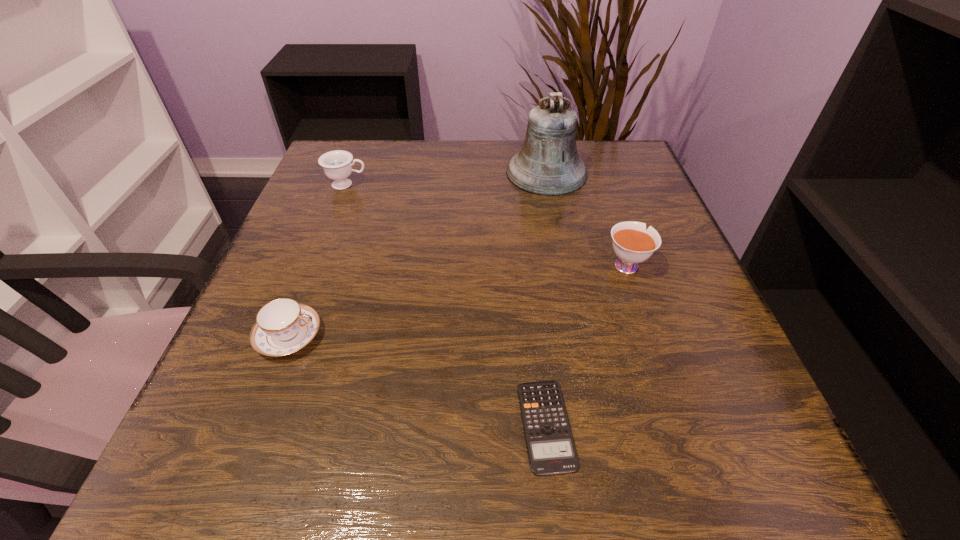
In order to click on the tallest object in this screenshot , I will do `click(548, 164)`.

You are a GUI agent. You are given a task and a screenshot of the screen. Output one action in this format:
    pyautogui.click(x=<x>, y=<y>)
    Task: Click on the second farthest teacup
    The width and height of the screenshot is (960, 540).
    Given the screenshot: What is the action you would take?
    pyautogui.click(x=632, y=243)

Locate an element on the screen. Image resolution: width=960 pixels, height=540 pixels. the rightmost teacup is located at coordinates (632, 243).

Identify the location of the farthest teacup. The height and width of the screenshot is (540, 960). point(337,165).

This screenshot has height=540, width=960. In order to click on the fourth farthest object in this screenshot , I will do `click(283, 326)`.

What are the coordinates of `the nearest teacup` in the screenshot? It's located at (283, 326).

Locate an element on the screen. This screenshot has width=960, height=540. the shortest object is located at coordinates (551, 449).

What are the coordinates of `calculator` in the screenshot? It's located at (551, 449).

I want to click on free spot located on the left of the bell, so click(x=427, y=173).

At what (x,y) coordinates should I click in order to perform the action: click on vacant space positioned 0.150m on the side of the third farthest object with the handle. Please return your answer as a coordinate pair (x, y). Looking at the image, I should click on (605, 202).